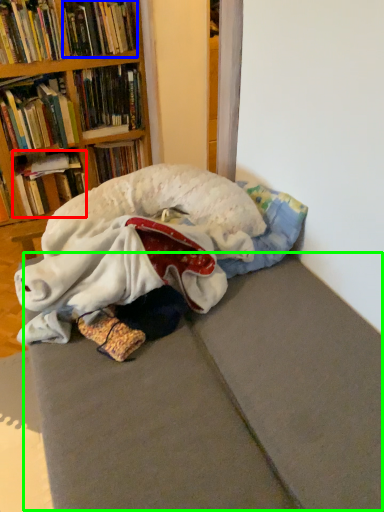
Question: Which is nearer to the book (highlighted by a red box)? book (highlighted by a blue box) or bed frame (highlighted by a green box).

Choices:
 (A) book
 (B) bed frame

Answer: (A)